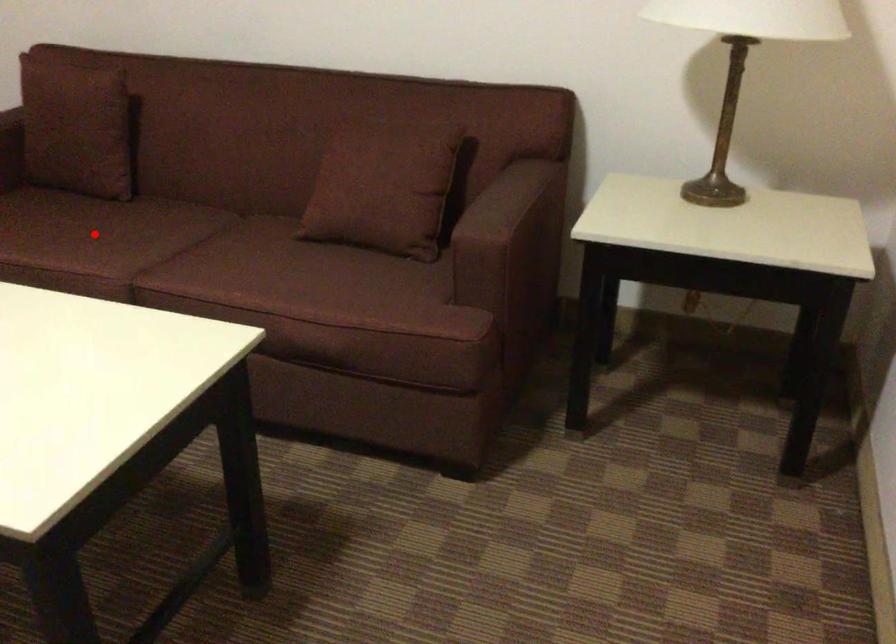
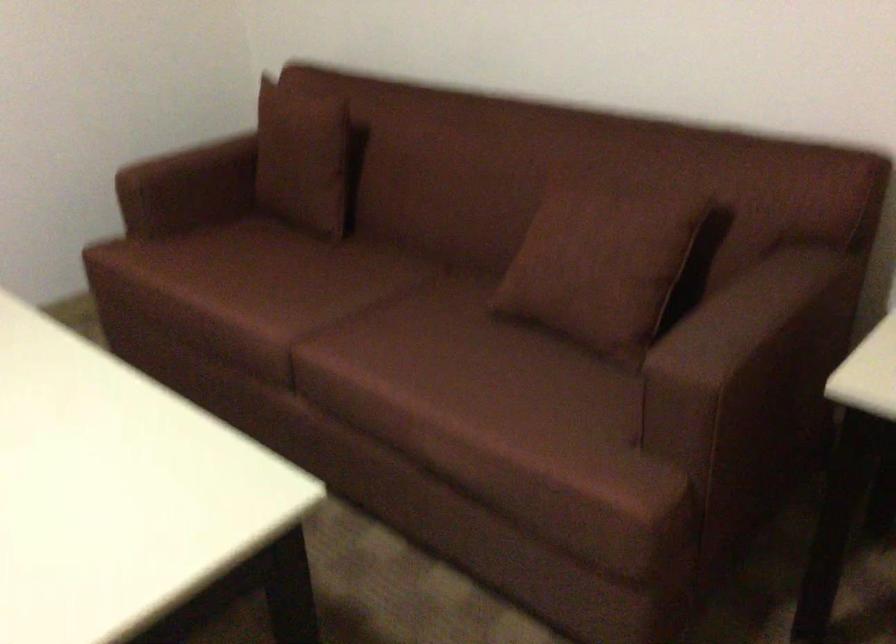
The point at the highlighted location is marked in the first image. Where is the corresponding point in the second image?

(286, 283)